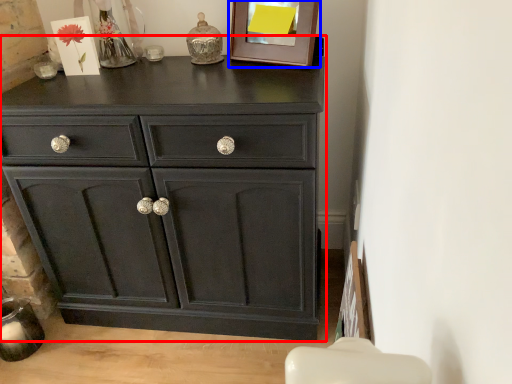
Question: Which point is closer to the camera, chest of drawers (highlighted by a red box) or picture frame (highlighted by a blue box)?

Choices:
 (A) chest of drawers
 (B) picture frame

Answer: (A)